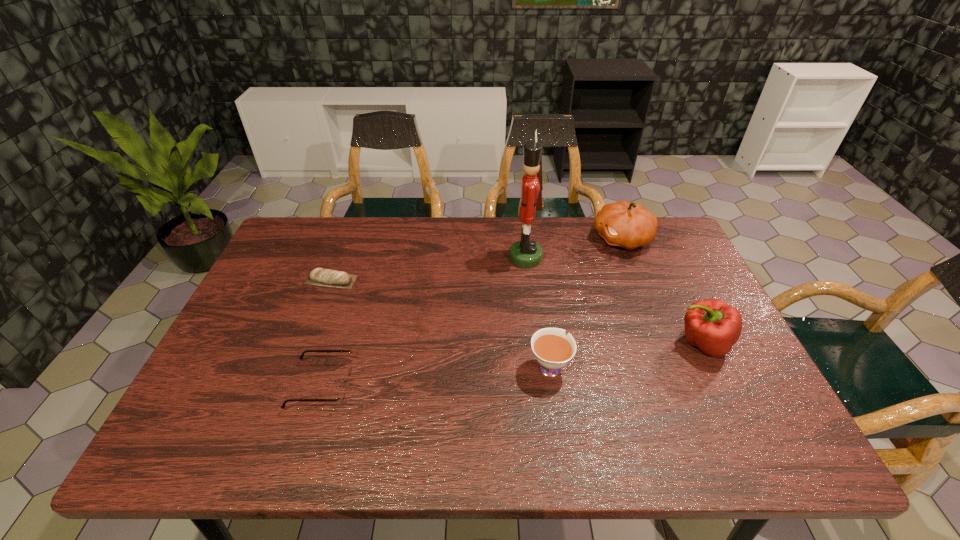
Where is `object identified as the third closest to the fourth shortest object`? This screenshot has width=960, height=540. object identified as the third closest to the fourth shortest object is located at coordinates (525, 253).

This screenshot has height=540, width=960. I want to click on vacant space that satisfies the following two spatial constraints: 1. on the front-facing side of the tallest object; 2. on the side of the teacup with the handle, so click(539, 366).

Locate an element on the screen. vacant area in the image that satisfies the following two spatial constraints: 1. on the back side of the bell pepper; 2. on the front-facing side of the tallest object is located at coordinates (661, 258).